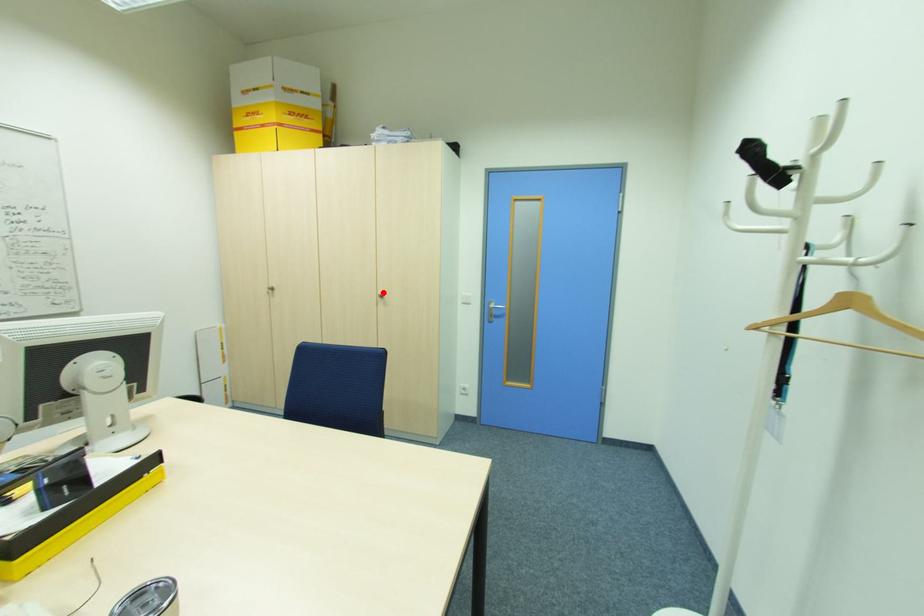
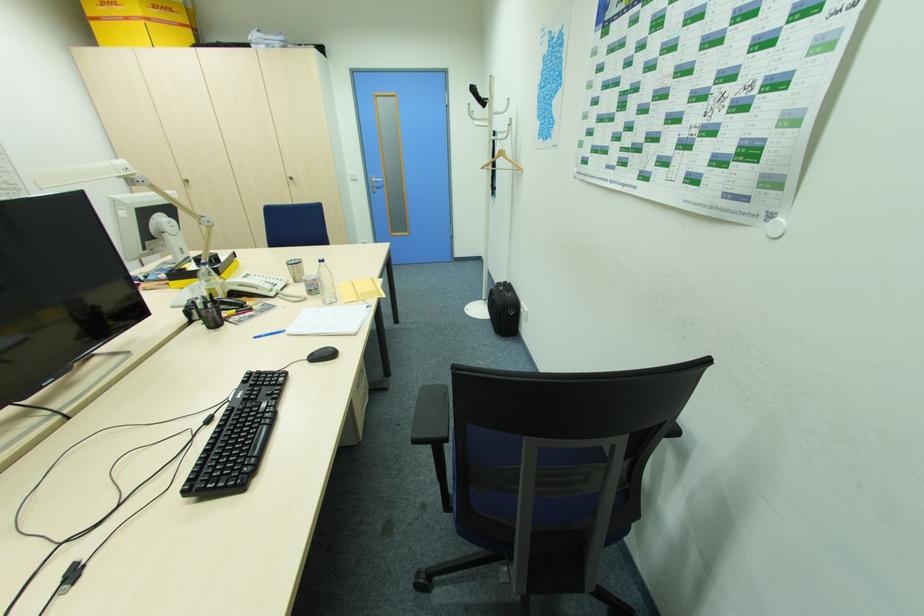
In the second image, find the point that corresponds to the highlighted location in the first image.

(292, 176)